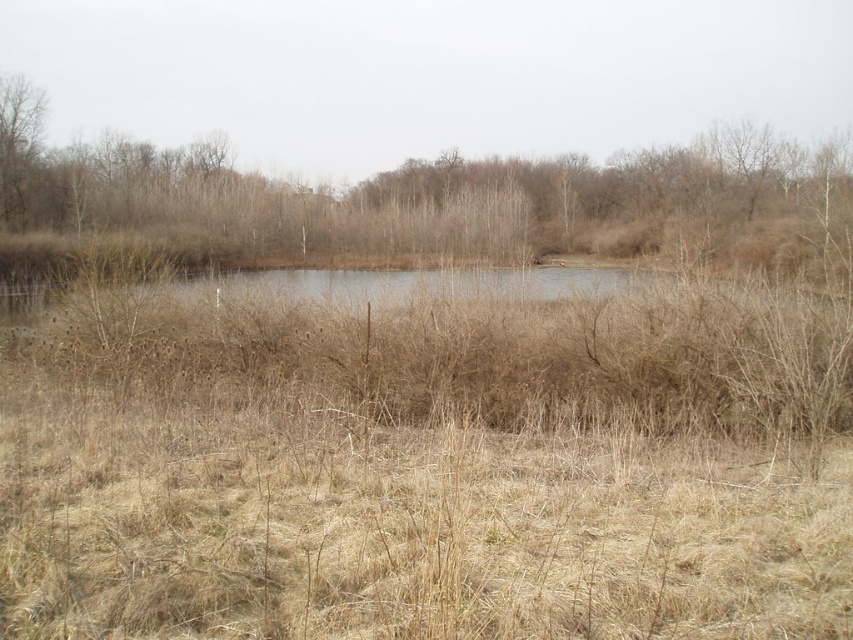
Does brown dry grass at center appear on the right side of bare branches at left?

Yes, brown dry grass at center is to the right of bare branches at left.

I want to click on brown dry grass at center, so click(419, 195).

Is point (621, 209) less distant than point (4, 186)?

No, it is not.

This screenshot has height=640, width=853. I want to click on brown dry grass at center, so click(419, 195).